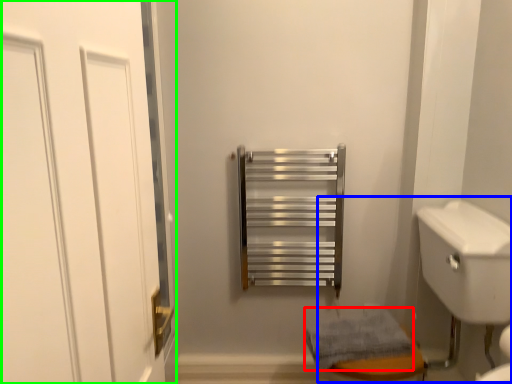
Question: Which is farther away from bath towel (highlighted by a red box)? sink (highlighted by a blue box) or door (highlighted by a green box)?

Choices:
 (A) sink
 (B) door

Answer: (B)